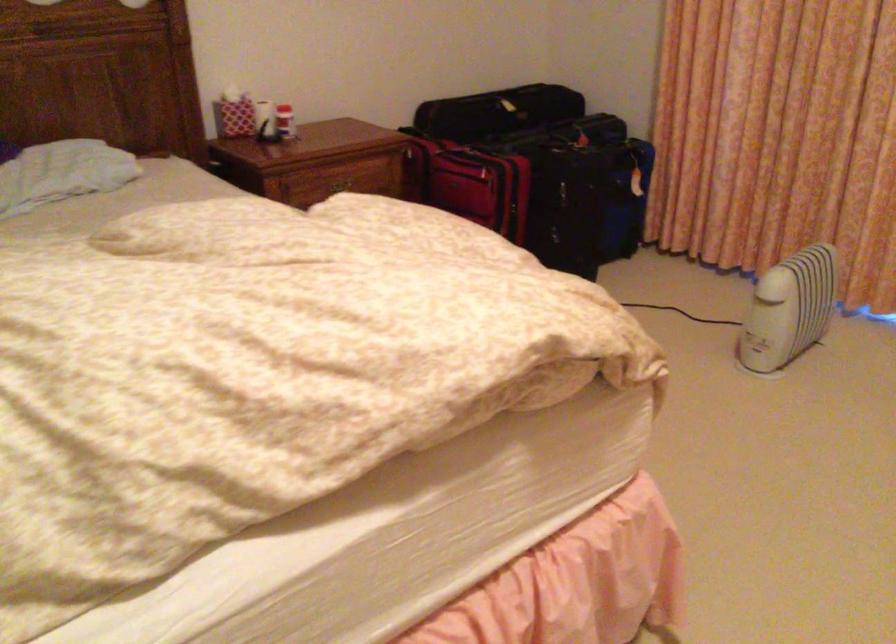
Identify the location of red and white bottle. (285, 122).